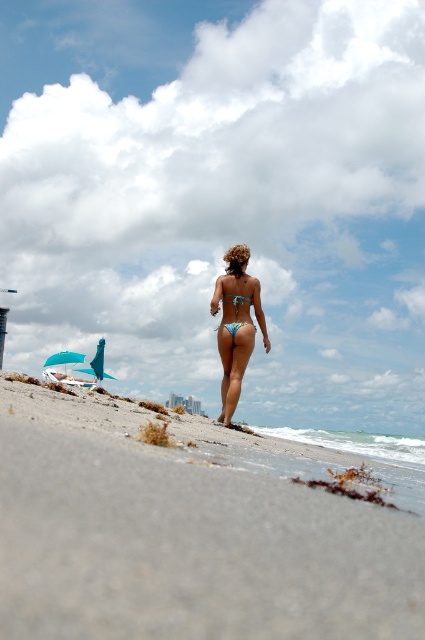
Looking at this image, you are a photographer standing at the edge of the beach. You want to capture a photo of the gray sand at lower center and the blue matte bikini top at center. Which object should you focus on first if you want the other to appear blurred in the background?

The gray sand at lower center is in front of the blue matte bikini top at center. To have the blue matte bikini top at center blurred in the background, focus on the gray sand at lower center first.

You are a photographer standing on the beach. You want to take a photo of the blue matte bikini top at center and the gray sand at lower center. Which object should you focus on first if you want to capture both in sharp focus?

The gray sand at lower center is below the blue matte bikini top at center, so to capture both in sharp focus, you should focus on the blue matte bikini top at center first since it is closer to the camera.